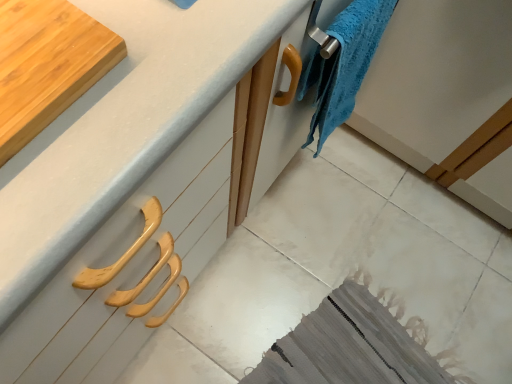
What are the coordinates of `wooden cutting board at upper left` in the screenshot? It's located at (47, 65).

At what (x,y) coordinates should I click in order to perform the action: click on white matte countertop at upper left. Please return your answer as a coordinate pair (x, y). The width and height of the screenshot is (512, 384). Looking at the image, I should click on (127, 185).

In the image, is blue fuzzy towel at upper right on the left side or the right side of wooden cutting board at upper left?

blue fuzzy towel at upper right is positioned on wooden cutting board at upper left's right side.

From the image's perspective, is blue fuzzy towel at upper right on top of wooden cutting board at upper left?

Yes, from the image's perspective, blue fuzzy towel at upper right is over wooden cutting board at upper left.

Which is closer, (x=361, y=58) or (x=75, y=84)?

Point (x=361, y=58) is positioned farther from the camera compared to point (x=75, y=84).

This screenshot has width=512, height=384. I want to click on cutting board that is above the blue fuzzy towel at upper right (from a real-world perspective), so click(47, 65).

What are the coordinates of `cutting board on the left of blue fuzzy towel at upper right` in the screenshot? It's located at (47, 65).

Is wooden cutting board at upper left outside of blue fuzzy towel at upper right?

Absolutely, wooden cutting board at upper left is external to blue fuzzy towel at upper right.

From a real-world perspective, which is physically below, wooden cutting board at upper left or blue fuzzy towel at upper right?

blue fuzzy towel at upper right is physically lower.

From the image's perspective, which one is positioned lower, wooden cutting board at upper left or blue fuzzy towel at upper right?

wooden cutting board at upper left appears lower in the image.

Which object is positioned more to the left, white matte countertop at upper left or wooden cutting board at upper left?

From the viewer's perspective, wooden cutting board at upper left appears more on the left side.

Does white matte countertop at upper left have a greater height compared to wooden cutting board at upper left?

Correct, white matte countertop at upper left is much taller as wooden cutting board at upper left.

Considering the positions of point (44, 338) and point (54, 2), is point (44, 338) closer or farther from the camera than point (54, 2)?

Clearly, point (44, 338) is more distant from the camera than point (54, 2).

Is there a large distance between white matte countertop at upper left and blue fuzzy towel at upper right?

No, white matte countertop at upper left is in close proximity to blue fuzzy towel at upper right.

Is point (227, 210) farther from viewer compared to point (364, 39)?

Yes.

Is white matte countertop at upper left bigger than blue fuzzy towel at upper right?

Indeed, white matte countertop at upper left has a larger size compared to blue fuzzy towel at upper right.

Considering the relative sizes of blue fuzzy towel at upper right and white matte countertop at upper left in the image provided, is blue fuzzy towel at upper right thinner than white matte countertop at upper left?

Indeed, blue fuzzy towel at upper right has a lesser width compared to white matte countertop at upper left.

Considering the positions of point (348, 9) and point (104, 313), is point (348, 9) closer or farther from the camera than point (104, 313)?

Point (348, 9).

Looking at this image, from a real-world perspective, which is physically below, blue fuzzy towel at upper right or white matte countertop at upper left?

white matte countertop at upper left.

Which of these two, blue fuzzy towel at upper right or white matte countertop at upper left, is smaller?

blue fuzzy towel at upper right.

Considering the relative positions of wooden cutting board at upper left and white matte countertop at upper left in the image provided, is wooden cutting board at upper left behind white matte countertop at upper left?

Yes, wooden cutting board at upper left is further from the camera.

From a real-world perspective, relative to white matte countertop at upper left, is wooden cutting board at upper left vertically above or below?

Clearly, from a real-world perspective, wooden cutting board at upper left is above white matte countertop at upper left.

What's the angular difference between wooden cutting board at upper left and white matte countertop at upper left's facing directions?

The angle between the facing direction of wooden cutting board at upper left and the facing direction of white matte countertop at upper left is 0.238 degrees.

This screenshot has height=384, width=512. In order to click on bath towel lying behind the wooden cutting board at upper left in this screenshot , I will do 343,65.

I want to click on bath towel that is above the wooden cutting board at upper left (from the image's perspective), so click(343, 65).

Considering their positions, is blue fuzzy towel at upper right positioned closer to wooden cutting board at upper left than white matte countertop at upper left?

white matte countertop at upper left.

Looking at the image, which one is located further to blue fuzzy towel at upper right, white matte countertop at upper left or wooden cutting board at upper left?

The object further to blue fuzzy towel at upper right is wooden cutting board at upper left.

Based on their spatial positions, is blue fuzzy towel at upper right or wooden cutting board at upper left closer to white matte countertop at upper left?

Among the two, wooden cutting board at upper left is located nearer to white matte countertop at upper left.

When comparing their distances from wooden cutting board at upper left, does white matte countertop at upper left or blue fuzzy towel at upper right seem further?

Based on the image, blue fuzzy towel at upper right appears to be further to wooden cutting board at upper left.

Which object lies further to the anchor point white matte countertop at upper left, wooden cutting board at upper left or blue fuzzy towel at upper right?

Based on the image, blue fuzzy towel at upper right appears to be further to white matte countertop at upper left.

When comparing their distances from blue fuzzy towel at upper right, does wooden cutting board at upper left or white matte countertop at upper left seem further?

wooden cutting board at upper left is positioned further to the anchor blue fuzzy towel at upper right.

Image resolution: width=512 pixels, height=384 pixels. Identify the location of countertop between wooden cutting board at upper left and blue fuzzy towel at upper right. (127, 185).